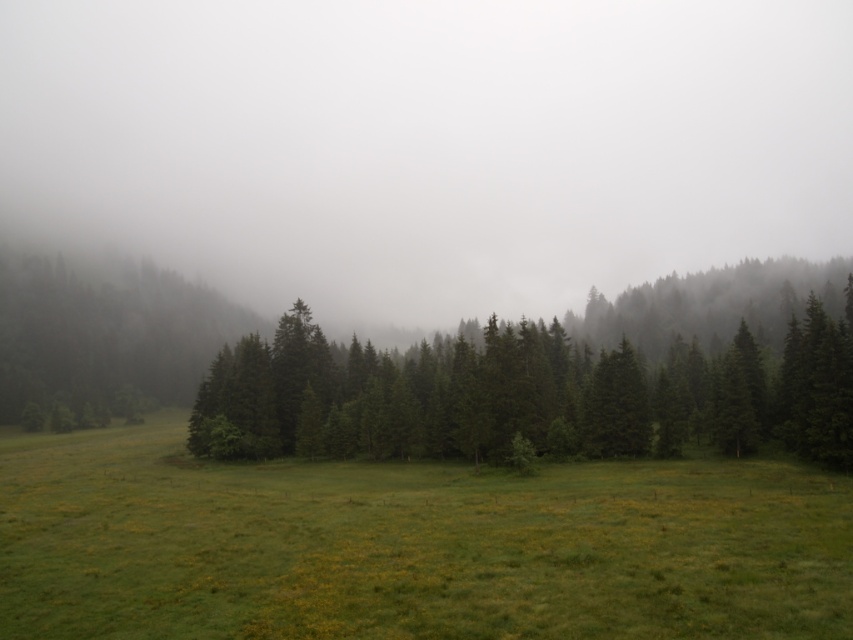
Question: Is green grass at center closer to camera compared to green matte tree at center?

Choices:
 (A) yes
 (B) no

Answer: (A)

Question: Among these points, which one is nearest to the camera?

Choices:
 (A) (708, 484)
 (B) (627, 410)

Answer: (A)

Question: Among these points, which one is farthest from the camera?

Choices:
 (A) (697, 624)
 (B) (309, 380)

Answer: (B)

Question: Does green grass at center have a smaller size compared to green matte tree at center?

Choices:
 (A) no
 (B) yes

Answer: (B)

Question: Is green grass at center thinner than green matte tree at center?

Choices:
 (A) yes
 (B) no

Answer: (A)